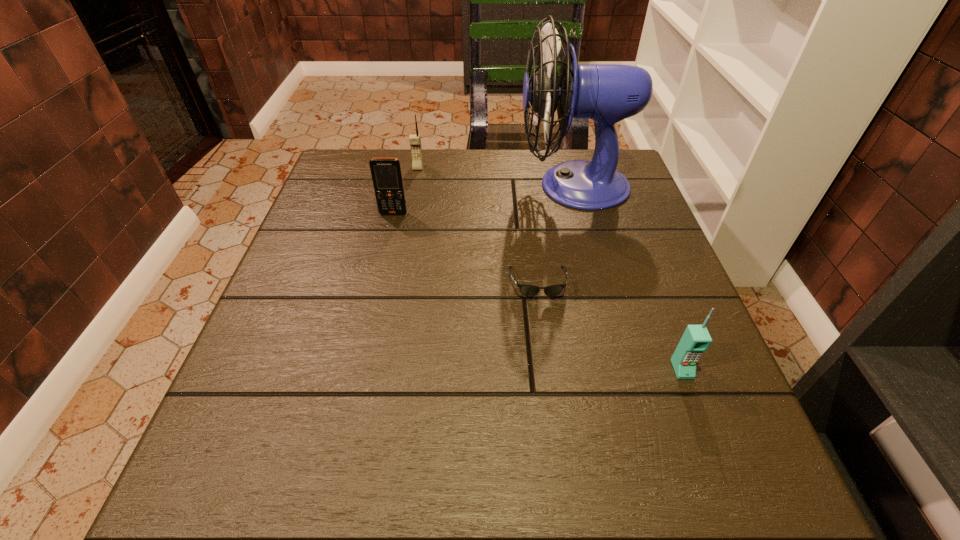
The width and height of the screenshot is (960, 540). Identify the location of vacant space at the near edge of the desktop. (316, 524).

Where is `free region at the left edge of the desktop`? The width and height of the screenshot is (960, 540). free region at the left edge of the desktop is located at coordinates 319,242.

In the image, there is a desktop. Where is `vacant space at the right edge`? vacant space at the right edge is located at coordinates click(623, 316).

This screenshot has height=540, width=960. In the image, there is a desktop. Find the location of `vacant space at the far left corner`. vacant space at the far left corner is located at coordinates (348, 156).

In order to click on free space at the near left corner of the desktop in this screenshot , I will do `click(220, 480)`.

You are a GUI agent. You are given a task and a screenshot of the screen. Output one action in this format:
    pyautogui.click(x=<x>, y=<y>)
    Task: Click on the free point between the nearest object and the tallest object
    
    Given the screenshot: What is the action you would take?
    pyautogui.click(x=628, y=278)

The height and width of the screenshot is (540, 960). What are the coordinates of `vacant point located between the farthest cellular telephone and the fourth farthest object` in the screenshot? It's located at (478, 225).

The height and width of the screenshot is (540, 960). Identify the location of vacant space in between the second nearest cellular telephone and the tallest object. (484, 200).

Locate an element on the screen. The height and width of the screenshot is (540, 960). free space between the second nearest object and the nearest cellular telephone is located at coordinates (610, 326).

Image resolution: width=960 pixels, height=540 pixels. I want to click on vacant area between the shortest object and the tallest object, so click(x=556, y=234).